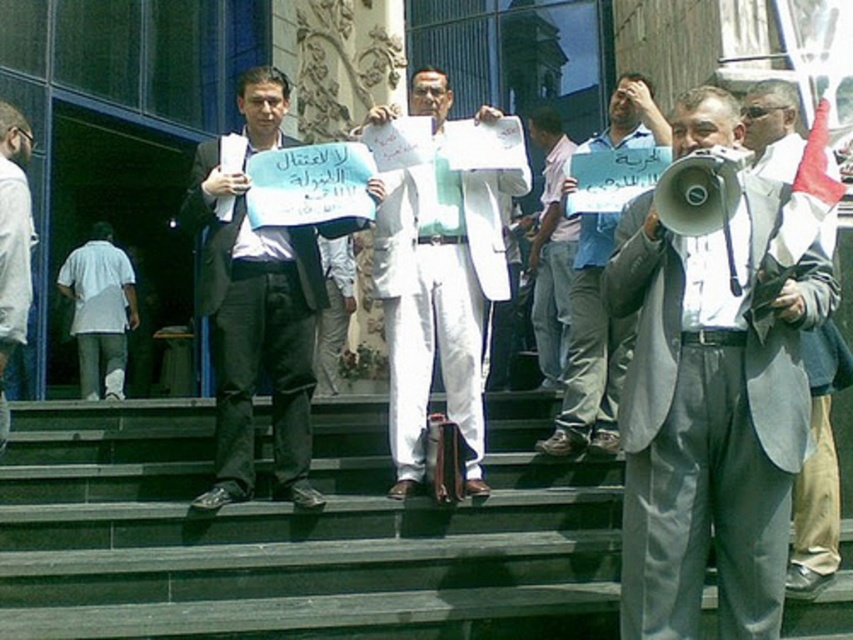
Does matte black suit at center appear on the left side of white cotton shirt at left?

Incorrect, matte black suit at center is not on the left side of white cotton shirt at left.

Who is taller, matte black suit at center or white cotton shirt at left?

matte black suit at center is taller.

Who is more distant from viewer, (x=224, y=433) or (x=132, y=320)?

Positioned behind is point (x=132, y=320).

You are a GUI agent. You are given a task and a screenshot of the screen. Output one action in this format:
    pyautogui.click(x=<x>, y=<y>)
    Task: Click on the matte black suit at center
    
    Given the screenshot: What is the action you would take?
    pyautogui.click(x=257, y=332)

Is white cotton shirt at left to the right of white cotton shirt at center from the viewer's perspective?

In fact, white cotton shirt at left is to the left of white cotton shirt at center.

Image resolution: width=853 pixels, height=640 pixels. Identify the location of white cotton shirt at left. pyautogui.click(x=100, y=310).

This screenshot has height=640, width=853. What are the coordinates of `white cotton shirt at left` in the screenshot? It's located at (100, 310).

Is gray suit at center shorter than light gray suit coat at center?

Yes.

The width and height of the screenshot is (853, 640). Describe the element at coordinates (711, 417) in the screenshot. I see `gray suit at center` at that location.

Image resolution: width=853 pixels, height=640 pixels. Identify the location of gray suit at center. (711, 417).